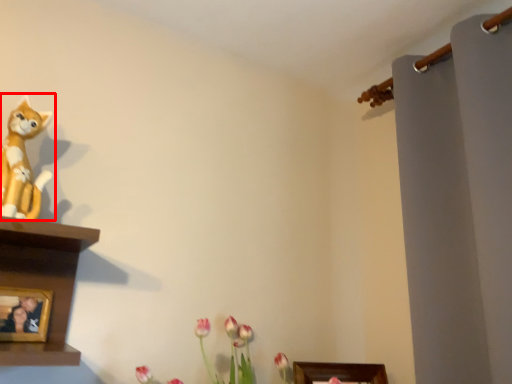
Question: Considering the relative positions of toy (annotated by the red box) and picture frame in the image provided, where is toy (annotated by the red box) located with respect to the staircase?

Choices:
 (A) left
 (B) right

Answer: (B)